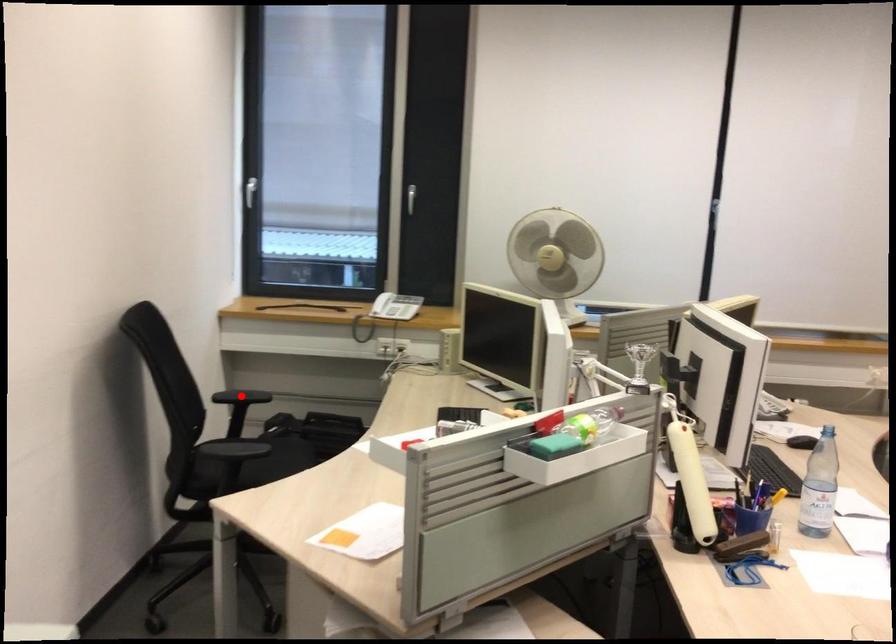
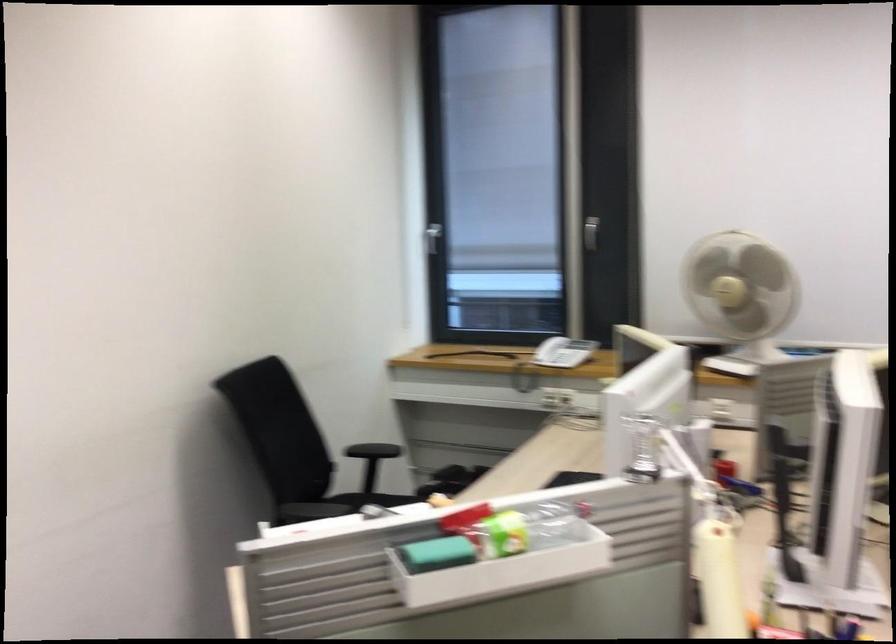
Question: I am providing you with two images of the same scene from different viewpoints. A red point is marked on the first image. Is the red point's position out of view in image 2?

Choices:
 (A) Yes
 (B) No

Answer: (A)